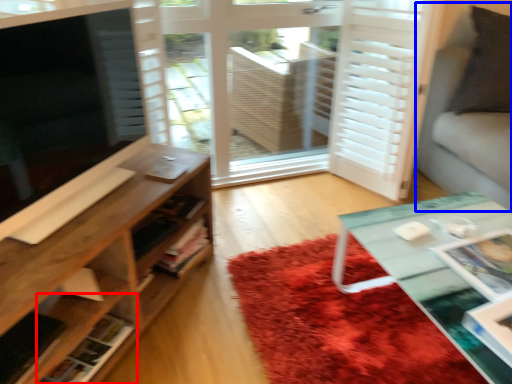
Question: Which of the following is the farthest to the observer, shelf (highlighted by a red box) or couch (highlighted by a blue box)?

Choices:
 (A) shelf
 (B) couch

Answer: (B)